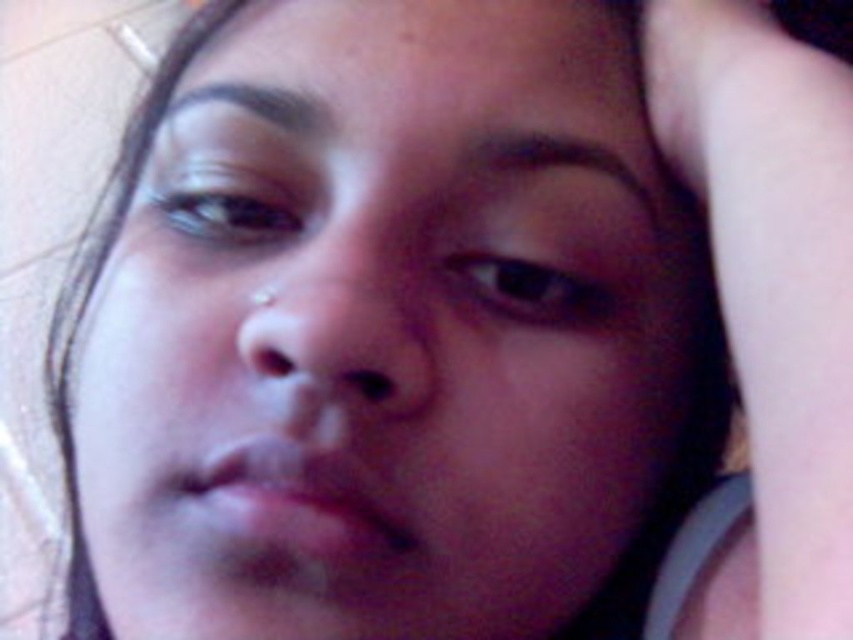
You are a photographer adjusting the lighting in a studio. You notice the pale skin arm at right and the brown matte eye at upper left in your frame. Which object is closer to the camera lens?

The pale skin arm at right is closer to the camera lens because it is in front of the brown matte eye at upper left.

You are a photographer adjusting the focus on your camera. You have two points in the image to focus on, point (762,413) and point (236,166). Which point should you focus on to ensure the subject is sharp and in focus?

Point (762,413) is closer to the camera than point (236,166), so focusing on point (762,413) will ensure the subject is sharp and in focus.